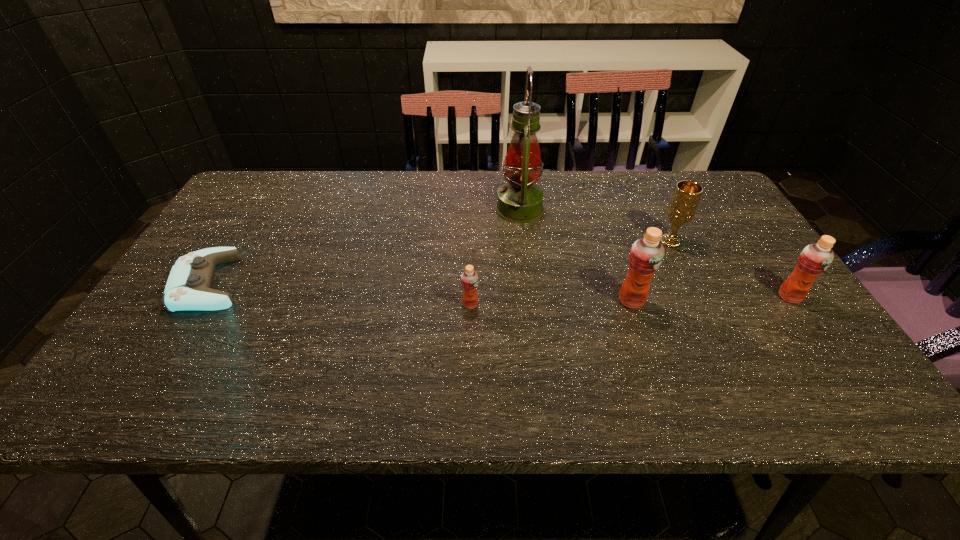
Identify the location of chalice. (682, 207).

Find the location of a particular element. The width and height of the screenshot is (960, 540). free space located on the back of the fifth object from right to left is located at coordinates (470, 278).

Find the location of `vacant area located 0.080m on the left of the third object from right to left`. vacant area located 0.080m on the left of the third object from right to left is located at coordinates (584, 301).

The width and height of the screenshot is (960, 540). Identify the location of vacant space located on the back of the second shortest orange juice. (737, 222).

Identify the location of vacant region located on the right of the farthest object. (643, 210).

What are the coordinates of `free space located on the right of the control` in the screenshot? It's located at (322, 284).

What are the coordinates of `vacant region located on the left of the second farthest object` in the screenshot? It's located at (607, 241).

In order to click on object located in the far edge section of the desktop in this screenshot , I will do `click(520, 201)`.

You are a GUI agent. You are given a task and a screenshot of the screen. Output one action in this format:
    pyautogui.click(x=<x>, y=<y>)
    Task: Click on the object that is at the left edge
    
    Given the screenshot: What is the action you would take?
    pyautogui.click(x=188, y=287)

The width and height of the screenshot is (960, 540). Identify the location of object located at the right edge. (815, 258).